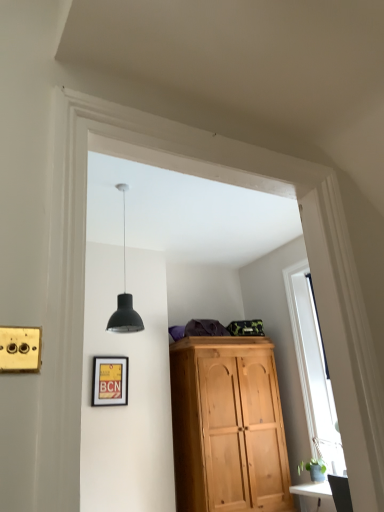
Question: From the image's perspective, is matte yellow picture frame at lower left beneath transparent glass window at right?

Choices:
 (A) yes
 (B) no

Answer: (A)

Question: Can you confirm if matte yellow picture frame at lower left is wider than transparent glass window at right?

Choices:
 (A) yes
 (B) no

Answer: (A)

Question: Are matte yellow picture frame at lower left and transparent glass window at right far apart?

Choices:
 (A) no
 (B) yes

Answer: (B)

Question: Considering the relative sizes of matte yellow picture frame at lower left and transparent glass window at right in the image provided, is matte yellow picture frame at lower left thinner than transparent glass window at right?

Choices:
 (A) yes
 (B) no

Answer: (B)

Question: Is matte yellow picture frame at lower left further to camera compared to transparent glass window at right?

Choices:
 (A) no
 (B) yes

Answer: (B)

Question: Visually, is matte black lampshade at center positioned to the left or to the right of transparent glass window at right?

Choices:
 (A) right
 (B) left

Answer: (B)

Question: Considering the positions of matte black lampshade at center and transparent glass window at right in the image, is matte black lampshade at center taller or shorter than transparent glass window at right?

Choices:
 (A) short
 (B) tall

Answer: (A)

Question: From the image's perspective, relative to transparent glass window at right, is matte black lampshade at center above or below?

Choices:
 (A) above
 (B) below

Answer: (A)

Question: In terms of width, does matte black lampshade at center look wider or thinner when compared to transparent glass window at right?

Choices:
 (A) wide
 (B) thin

Answer: (A)

Question: From the image's perspective, relative to transparent glass window at right, is matte yellow picture frame at lower left above or below?

Choices:
 (A) above
 (B) below

Answer: (B)

Question: In terms of width, does matte yellow picture frame at lower left look wider or thinner when compared to transparent glass window at right?

Choices:
 (A) wide
 (B) thin

Answer: (A)

Question: From a real-world perspective, relative to transparent glass window at right, is matte yellow picture frame at lower left vertically above or below?

Choices:
 (A) above
 (B) below

Answer: (B)

Question: Is point (112, 379) positioned closer to the camera than point (334, 460)?

Choices:
 (A) farther
 (B) closer

Answer: (A)

Question: From the image's perspective, is transparent glass window at right positioned above or below matte black lampshade at center?

Choices:
 (A) below
 (B) above

Answer: (A)

Question: Choose the correct answer: Is transparent glass window at right inside matte black lampshade at center or outside it?

Choices:
 (A) outside
 (B) inside

Answer: (A)